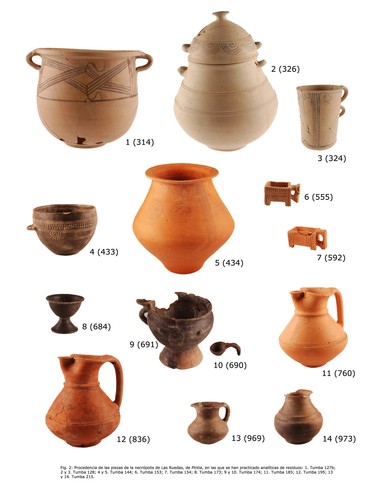
Where is `handles on brown vase in upper left`? handles on brown vase in upper left is located at coordinates (150, 60), (27, 58).